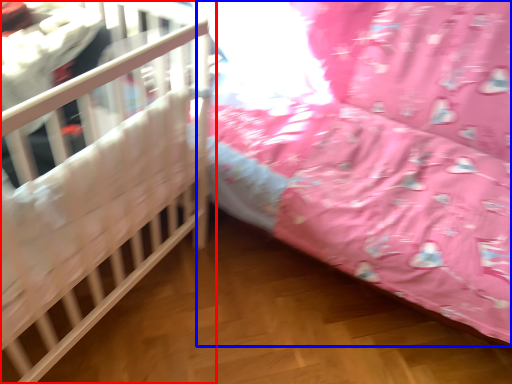
Question: Which object appears farthest to the camera in this image, infant bed (highlighted by a red box) or infant bed (highlighted by a blue box)?

Choices:
 (A) infant bed
 (B) infant bed

Answer: (B)